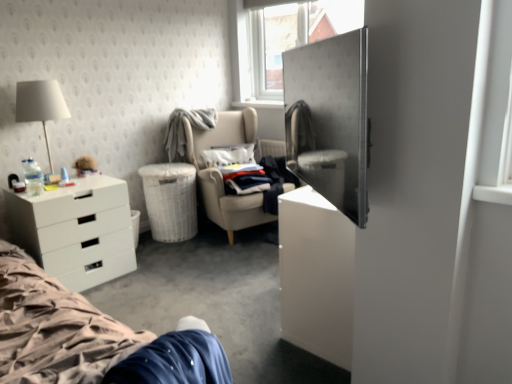
What is the approximate width of gray fabric clothing at center?

gray fabric clothing at center is 14.09 inches in width.

This screenshot has height=384, width=512. Describe the element at coordinates (330, 119) in the screenshot. I see `metallic silver armoire at right` at that location.

This screenshot has width=512, height=384. What do you see at coordinates (33, 177) in the screenshot?
I see `clear plastic bottle at left` at bounding box center [33, 177].

What do you see at coordinates (40, 105) in the screenshot? I see `white matte lampshade at upper left` at bounding box center [40, 105].

At what (x,y) coordinates should I click in order to perform the action: click on gray fabric clothing at center. Please return your answer as a coordinate pair (x, y). Looking at the image, I should click on (184, 130).

From the image's perspective, would you say beige fabric chair at center is positioned over white matte lampshade at upper left?

Incorrect, from the image's perspective, beige fabric chair at center is lower than white matte lampshade at upper left.

From a real-world perspective, who is located lower, beige fabric chair at center or white matte lampshade at upper left?

From a 3D spatial view, beige fabric chair at center is below.

Which of these two, beige fabric chair at center or white matte lampshade at upper left, stands shorter?

With less height is white matte lampshade at upper left.

Can you tell me how much white fabric pillow at center and gray fabric clothing at center differ in facing direction?

white fabric pillow at center and gray fabric clothing at center are facing 40.1 degrees away from each other.

Is white fabric pillow at center positioned far away from gray fabric clothing at center?

No.

Is white fabric pillow at center closer to camera compared to gray fabric clothing at center?

No, it is not.

Does white fabric pillow at center appear on the left side of gray fabric clothing at center?

No.

Does white matte lampshade at upper left have a larger size compared to gray fabric clothing at center?

Actually, white matte lampshade at upper left might be smaller than gray fabric clothing at center.

From a real-world perspective, relative to gray fabric clothing at center, is white matte lampshade at upper left vertically above or below?

white matte lampshade at upper left is above gray fabric clothing at center.

Is gray fabric clothing at center at the back of white matte lampshade at upper left?

No, gray fabric clothing at center is not at the back of white matte lampshade at upper left.

How many degrees apart are the facing directions of white matte lampshade at upper left and gray fabric clothing at center?

The facing directions of white matte lampshade at upper left and gray fabric clothing at center are 1.17 degrees apart.

Is point (249, 163) closer to viewer compared to point (240, 143)?

Yes, point (249, 163) is in front of point (240, 143).

Which object is positioned more to the left, white fabric pillow at center or beige fabric chair at center?

white fabric pillow at center is more to the left.

Are white fabric pillow at center and beige fabric chair at center making contact?

No, white fabric pillow at center is not touching beige fabric chair at center.

Which of these two, white fabric pillow at center or beige fabric chair at center, is thinner?

With smaller width is white fabric pillow at center.

In the scene shown: Who is bigger, white woven trash bin/can at lower left or beige fabric chair at center?

Bigger between the two is beige fabric chair at center.

Which point is more forward, (158, 202) or (218, 179)?

The point (218, 179) is closer to the camera.

Could beige fabric chair at center be considered to be inside white woven trash bin/can at lower left?

Actually, beige fabric chair at center is outside white woven trash bin/can at lower left.

How distant is white woven trash bin/can at lower left from beige fabric chair at center?

white woven trash bin/can at lower left and beige fabric chair at center are 14.15 inches apart.

Is white fabric pillow at center at the back of beige fabric chair at center?

Yes, beige fabric chair at center is positioned with its back facing white fabric pillow at center.

Does beige fabric chair at center have a larger size compared to white fabric pillow at center?

Yes.

Considering the positions of objects beige fabric chair at center and white fabric pillow at center in the image provided, who is in front, beige fabric chair at center or white fabric pillow at center?

beige fabric chair at center is in front.

From a real-world perspective, is beige fabric chair at center physically below white fabric pillow at center?

Indeed, from a real-world perspective, beige fabric chair at center is positioned beneath white fabric pillow at center.

Considering the sizes of white matte lampshade at upper left and clear plastic bottle at left in the image, is white matte lampshade at upper left wider or thinner than clear plastic bottle at left?

Clearly, white matte lampshade at upper left has more width compared to clear plastic bottle at left.

Is white matte lampshade at upper left not close to clear plastic bottle at left?

No, there isn't a large distance between white matte lampshade at upper left and clear plastic bottle at left.

I want to click on bottle that appears below the white matte lampshade at upper left (from the image's perspective), so click(33, 177).

Where is `chair below the white matte lampshade at upper left (from a real-world perspective)`? chair below the white matte lampshade at upper left (from a real-world perspective) is located at coordinates (221, 174).

Locate an element on the screen. pillow behind the gray fabric clothing at center is located at coordinates (228, 155).

Based on their spatial positions, is white woven trash bin/can at lower left or white matte lampshade at upper left further from white fabric pillow at center?

Based on the image, white matte lampshade at upper left appears to be further to white fabric pillow at center.

Estimate the real-world distances between objects in this image. Which object is closer to white fabric pillow at center, white matte lampshade at upper left or clear plastic bottle at left?

white matte lampshade at upper left lies closer to white fabric pillow at center than the other object.

From the image, which object appears to be nearer to gray fabric clothing at center, metallic silver armoire at right or clear plastic bottle at left?

clear plastic bottle at left is closer to gray fabric clothing at center.

Which object lies further to the anchor point gray fabric clothing at center, white matte lampshade at upper left or white woven trash bin/can at lower left?

Based on the image, white matte lampshade at upper left appears to be further to gray fabric clothing at center.

When comparing their distances from gray fabric clothing at center, does white woven trash bin/can at lower left or beige fabric chair at center seem closer?

The object closer to gray fabric clothing at center is beige fabric chair at center.

Which object lies nearer to the anchor point gray fabric clothing at center, white matte drawer at lower left or clear plastic bottle at left?

white matte drawer at lower left is positioned closer to the anchor gray fabric clothing at center.

Based on their spatial positions, is clear plastic bottle at left or white matte drawer at lower left closer to metallic silver armoire at right?

white matte drawer at lower left is positioned closer to the anchor metallic silver armoire at right.

Considering their positions, is clear plastic bottle at left positioned further to white fabric pillow at center than white matte lampshade at upper left?

clear plastic bottle at left lies further to white fabric pillow at center than the other object.

Image resolution: width=512 pixels, height=384 pixels. I want to click on lamp between white matte drawer at lower left and gray fabric clothing at center in the front-back direction, so click(40, 105).

Where is `trash bin/can located between white matte lampshade at upper left and white fabric pillow at center in the left-right direction`? This screenshot has width=512, height=384. trash bin/can located between white matte lampshade at upper left and white fabric pillow at center in the left-right direction is located at coordinates (170, 200).

In order to click on chair between metallic silver armoire at right and white fabric pillow at center from front to back in this screenshot , I will do `click(221, 174)`.

At what (x,y) coordinates should I click in order to perform the action: click on clothing between white matte lampshade at upper left and beige fabric chair at center. Please return your answer as a coordinate pair (x, y). Looking at the image, I should click on (184, 130).